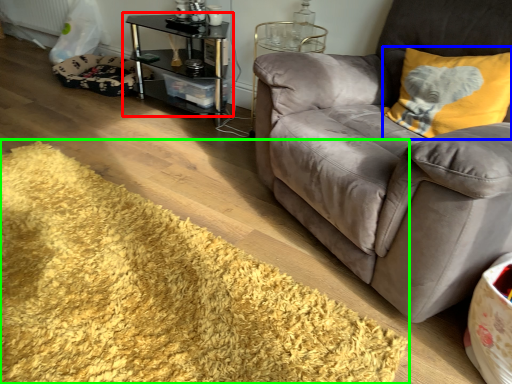
Question: Which object is positioned closest to table (highlighted by a red box)? Select from throw pillow (highlighted by a blue box) and mat (highlighted by a green box).

Choices:
 (A) throw pillow
 (B) mat

Answer: (B)